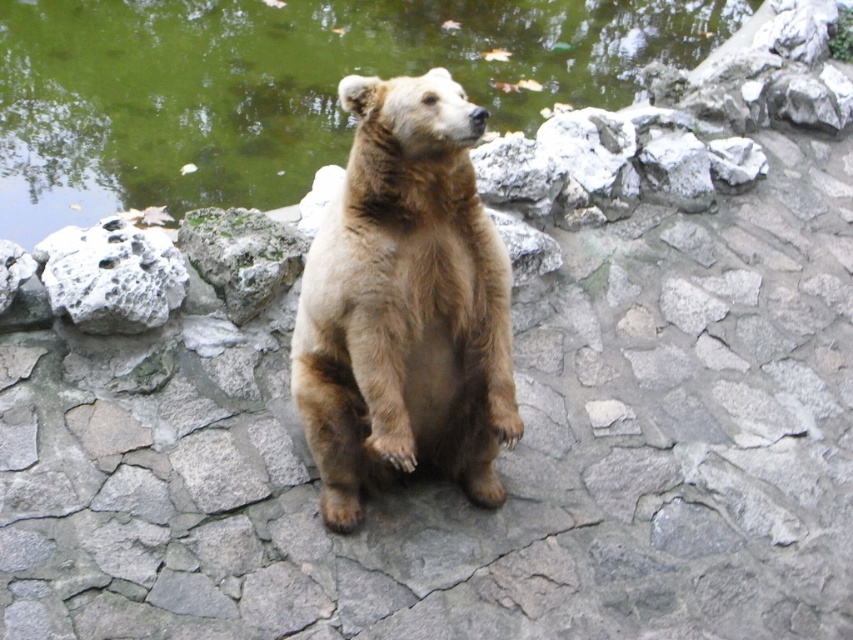
Question: Does green water at upper center come behind white porous rock at left?

Choices:
 (A) no
 (B) yes

Answer: (B)

Question: Is green water at upper center below white porous rock at left?

Choices:
 (A) yes
 (B) no

Answer: (B)

Question: Considering the relative positions of green water at upper center and brown furry bear at center in the image provided, where is green water at upper center located with respect to brown furry bear at center?

Choices:
 (A) below
 (B) above

Answer: (B)

Question: Which point is closer to the camera?

Choices:
 (A) brown furry bear at center
 (B) white porous rock at left

Answer: (A)

Question: Which of the following is the closest to the observer?

Choices:
 (A) brown furry bear at center
 (B) white porous rock at left
 (C) green mossy rock at center
 (D) green water at upper center

Answer: (A)

Question: Which is nearer to the green mossy rock at center?

Choices:
 (A) green water at upper center
 (B) white porous rock at left

Answer: (B)